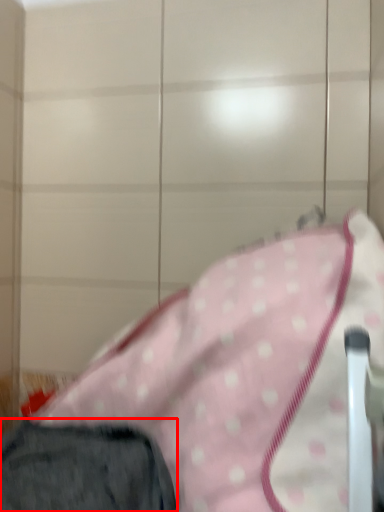
Question: In this image, where is trousers (annotated by the red box) located relative to blanket?

Choices:
 (A) right
 (B) left

Answer: (B)